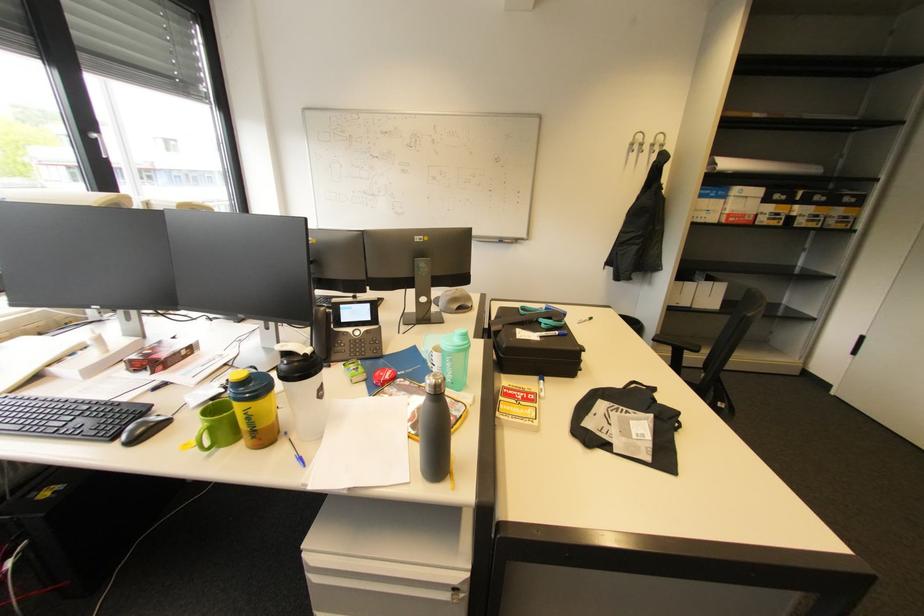
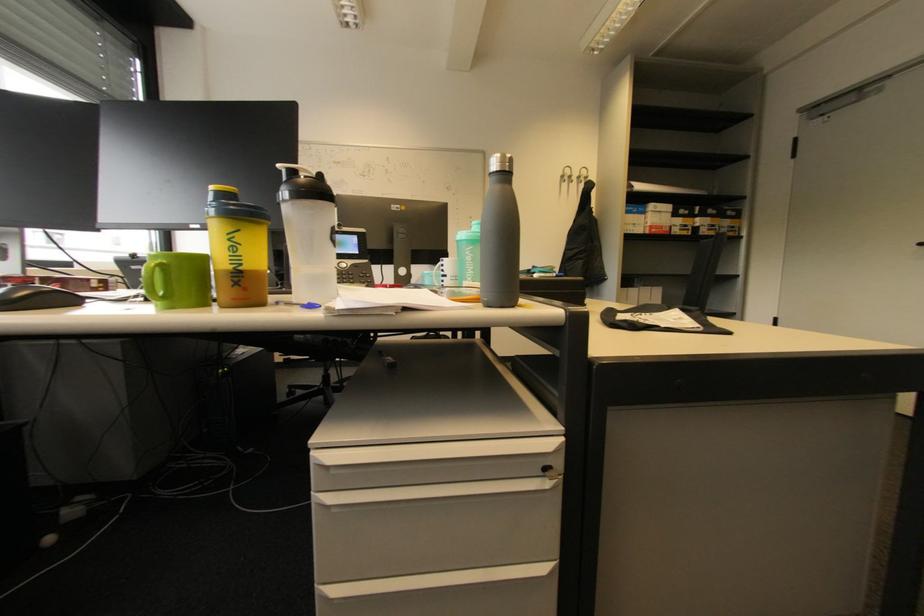
Question: The first image is from the beginning of the video and the second image is from the end. How did the camera likely rotate when shooting the video?

Choices:
 (A) Left
 (B) Right
 (C) Up
 (D) Down

Answer: (C)